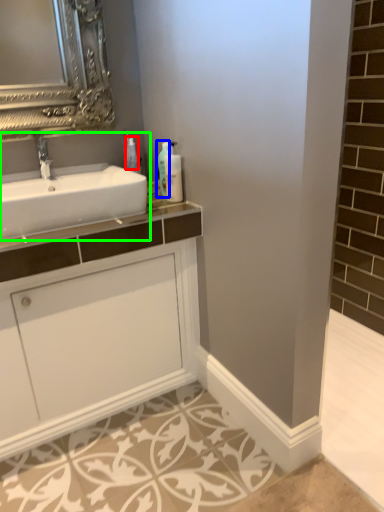
Question: Which object is positioned farthest from toiletry (highlighted by a red box)? Select from soap dispenser (highlighted by a blue box) and sink (highlighted by a green box).

Choices:
 (A) soap dispenser
 (B) sink

Answer: (B)